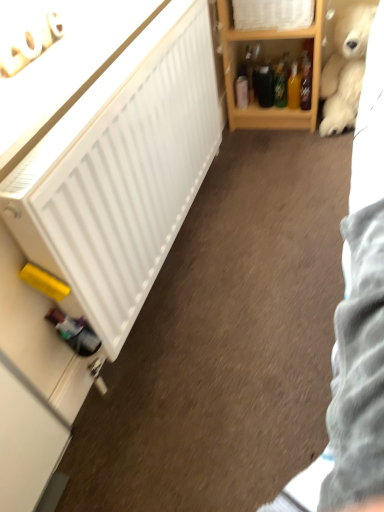
Question: Does fluffy white teddy bear at upper right appear on the left side of translucent plastic bottle at upper right?

Choices:
 (A) yes
 (B) no

Answer: (B)

Question: Is there a large distance between fluffy white teddy bear at upper right and translucent plastic bottle at upper right?

Choices:
 (A) yes
 (B) no

Answer: (B)

Question: Is fluffy white teddy bear at upper right taller than translucent plastic bottle at upper right?

Choices:
 (A) no
 (B) yes

Answer: (B)

Question: Does fluffy white teddy bear at upper right lie in front of translucent plastic bottle at upper right?

Choices:
 (A) yes
 (B) no

Answer: (A)

Question: Is fluffy white teddy bear at upper right outside translucent plastic bottle at upper right?

Choices:
 (A) no
 (B) yes

Answer: (B)

Question: Considering the positions of point (307, 100) and point (271, 11), is point (307, 100) closer or farther from the camera than point (271, 11)?

Choices:
 (A) farther
 (B) closer

Answer: (A)

Question: Relative to white wood cabinet at upper center, is translucent plastic bottle at upper right in front or behind?

Choices:
 (A) behind
 (B) front

Answer: (A)

Question: Looking at the image, does translucent plastic bottle at upper right seem bigger or smaller compared to white wood cabinet at upper center?

Choices:
 (A) small
 (B) big

Answer: (A)

Question: In the image, is translucent plastic bottle at upper right on the left side or the right side of white wood cabinet at upper center?

Choices:
 (A) left
 (B) right

Answer: (B)

Question: In terms of width, does white wood cabinet at upper center look wider or thinner when compared to translucent plastic bottle at upper right?

Choices:
 (A) thin
 (B) wide

Answer: (B)

Question: In the image, is white wood cabinet at upper center positioned in front of or behind translucent plastic bottle at upper right?

Choices:
 (A) behind
 (B) front

Answer: (B)

Question: Considering the relative positions of white wood cabinet at upper center and translucent plastic bottle at upper right in the image provided, is white wood cabinet at upper center to the left or to the right of translucent plastic bottle at upper right?

Choices:
 (A) right
 (B) left

Answer: (B)

Question: Is point (284, 8) positioned closer to the camera than point (304, 59)?

Choices:
 (A) farther
 (B) closer

Answer: (B)

Question: Do you think fluffy white teddy bear at upper right is within wooden shelf at upper right, or outside of it?

Choices:
 (A) outside
 (B) inside

Answer: (A)

Question: Considering the positions of fluffy white teddy bear at upper right and wooden shelf at upper right in the image, is fluffy white teddy bear at upper right taller or shorter than wooden shelf at upper right?

Choices:
 (A) short
 (B) tall

Answer: (A)